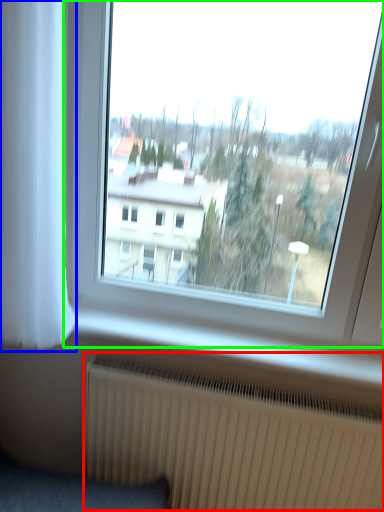
Question: Which object is the farthest from radiator (highlighted by a red box)? Choose among these: curtain (highlighted by a blue box) or window (highlighted by a green box).

Choices:
 (A) curtain
 (B) window

Answer: (B)